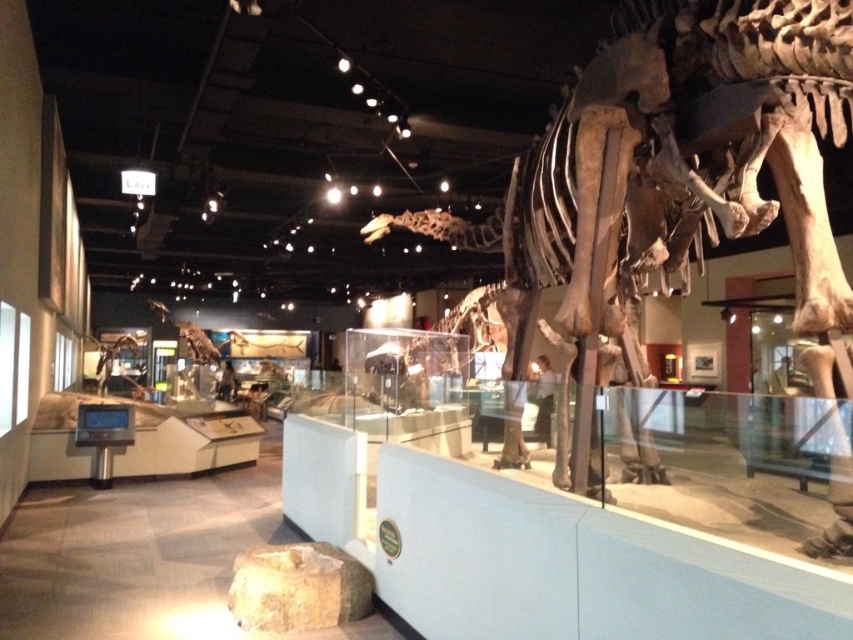
Can you confirm if shiny metallic dinosaur at lower left is positioned above shiny metallic dinosaur skeleton at center?

Actually, shiny metallic dinosaur at lower left is below shiny metallic dinosaur skeleton at center.

Who is taller, shiny metallic dinosaur at lower left or shiny metallic dinosaur skeleton at center?

shiny metallic dinosaur at lower left

Does point (108, 340) come farther from viewer compared to point (181, 337)?

Yes.

Find the location of a particular element. This screenshot has height=640, width=853. shiny metallic dinosaur at lower left is located at coordinates point(119,362).